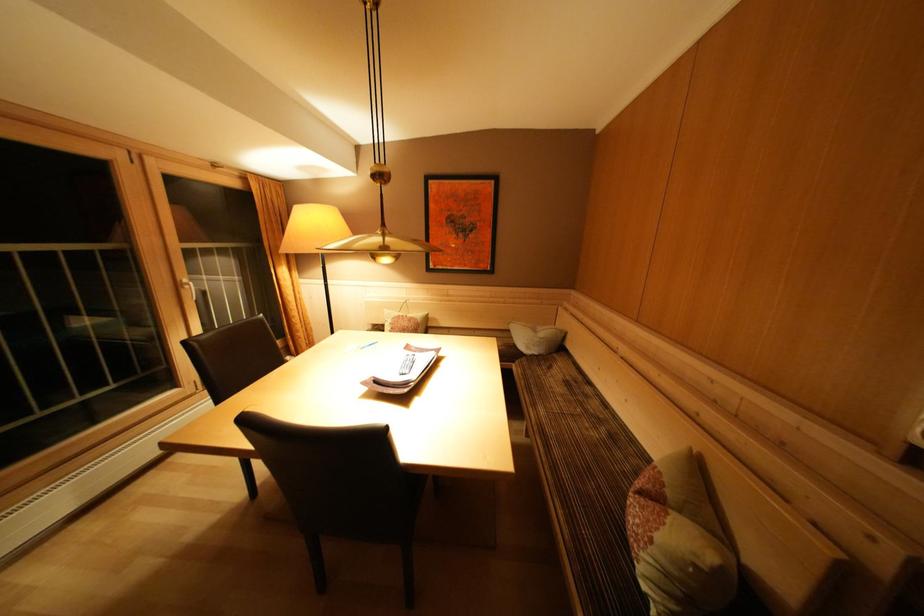
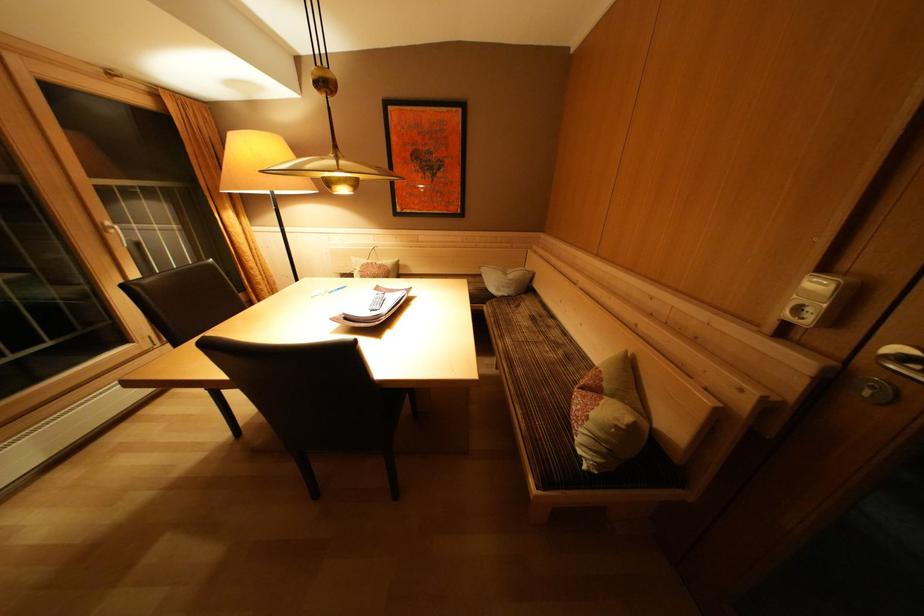
Locate, in the second image, the point that corresponds to (593,400) in the first image.

(555, 331)